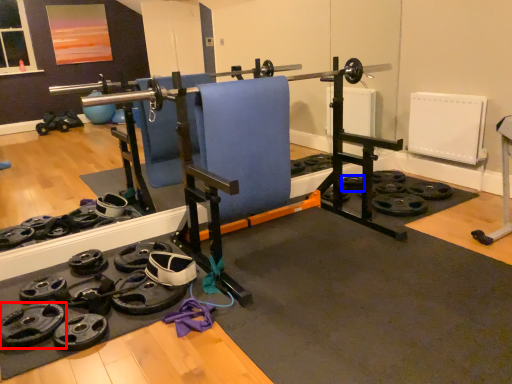
Question: Which object is further to the camera taking this photo, wheel (highlighted by a red box) or wheel (highlighted by a blue box)?

Choices:
 (A) wheel
 (B) wheel

Answer: (B)